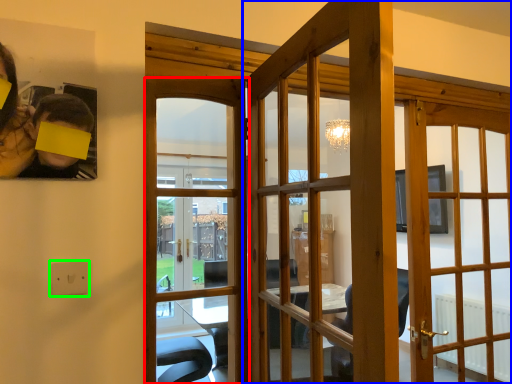
Question: Based on their relative distances, which object is farther from door (highlighted by a red box)? Choose from door (highlighted by a blue box) and electric outlet (highlighted by a green box).

Choices:
 (A) door
 (B) electric outlet

Answer: (B)